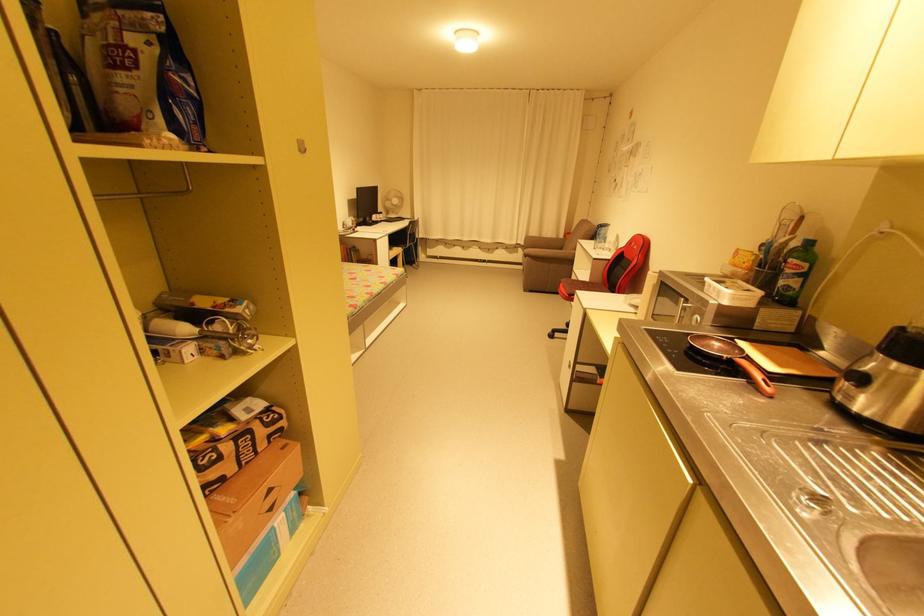
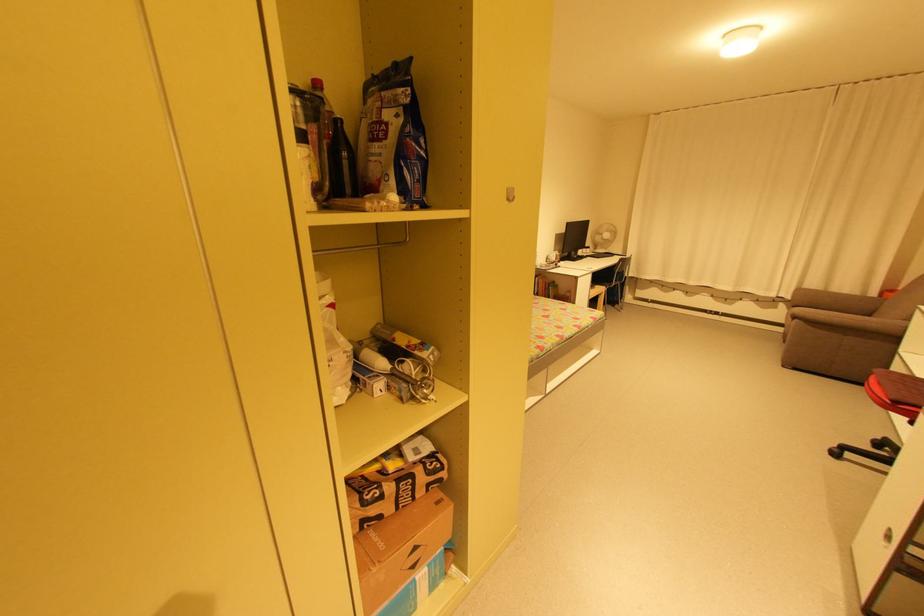
Where in the second image is the point corresponding to point (288, 442) from the first image?

(445, 495)